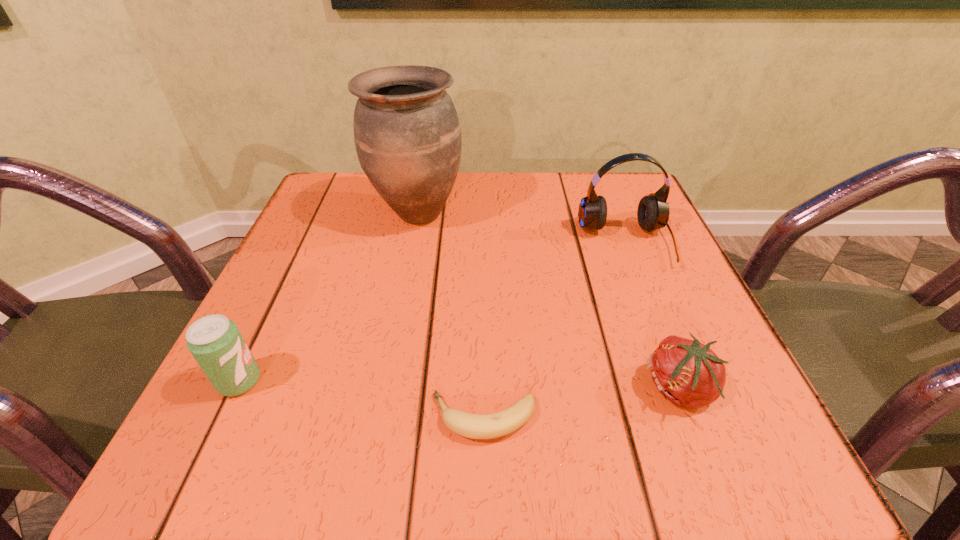
You are a GUI agent. You are given a task and a screenshot of the screen. Output one action in this format:
    pyautogui.click(x=<x>, y=<y>)
    Task: Click on the second closest object to the banana
    This screenshot has height=540, width=960.
    Given the screenshot: What is the action you would take?
    pyautogui.click(x=215, y=342)

Locate an element on the screen. The image size is (960, 540). object that is the third closest to the tallest object is located at coordinates (474, 426).

This screenshot has height=540, width=960. I want to click on vacant space that satisfies the following two spatial constraints: 1. on the ear cushions of the second tallest object; 2. at the stem of the banana, so tap(695, 417).

You are a GUI agent. You are given a task and a screenshot of the screen. Output one action in this format:
    pyautogui.click(x=<x>, y=<y>)
    Task: Click on the free space that satisfies the following two spatial constraints: 1. on the front side of the fourth tallest object; 2. on the right side of the leftmost object
    
    Given the screenshot: What is the action you would take?
    pyautogui.click(x=236, y=389)

Where is `free space that satisfies the following two spatial constraints: 1. on the front side of the second shortest object; 2. on the right side of the soda`? The image size is (960, 540). free space that satisfies the following two spatial constraints: 1. on the front side of the second shortest object; 2. on the right side of the soda is located at coordinates (236, 389).

You are a GUI agent. You are given a task and a screenshot of the screen. Output one action in this format:
    pyautogui.click(x=<x>, y=<y>)
    Task: Click on the vacant space that satisfies the following two spatial constraints: 1. on the ear cushions of the second tallest object; 2. at the stem of the shortest object
    This screenshot has height=540, width=960.
    Given the screenshot: What is the action you would take?
    pyautogui.click(x=695, y=417)

Locate an element on the screen. This screenshot has width=960, height=540. blank space that satisfies the following two spatial constraints: 1. on the ear cushions of the headset; 2. at the stem of the banana is located at coordinates (695, 417).